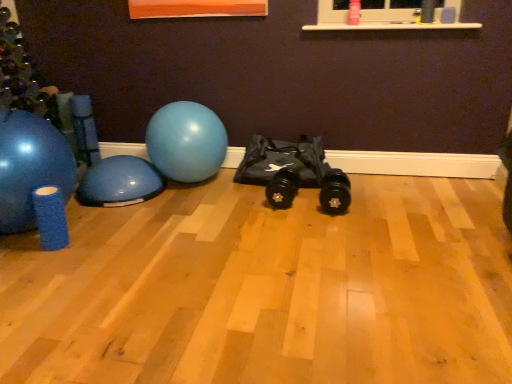
Question: From a real-world perspective, is blue rubber ball at left, which ranks as the 2th ball in left-to-right order, above or below matte blue exercise ball at left, which is the third ball in right-to-left order?

Choices:
 (A) below
 (B) above

Answer: (A)

Question: Is blue rubber ball at left, the second ball when ordered from right to left, situated inside matte blue exercise ball at left, arranged as the first ball when viewed from the left, or outside?

Choices:
 (A) outside
 (B) inside

Answer: (A)

Question: Which object is positioned farthest from the matte blue exercise ball at left, which is the third ball in right-to-left order?

Choices:
 (A) glossy rubber ball at center, which is the 3th ball in left-to-right order
 (B) blue rubber ball at left, which ranks as the 2th ball in left-to-right order

Answer: (A)

Question: Estimate the real-world distances between objects in this image. Which object is farther from the blue rubber ball at left, which ranks as the 2th ball in left-to-right order?

Choices:
 (A) glossy rubber ball at center, the first ball when ordered from right to left
 (B) matte blue exercise ball at left, arranged as the first ball when viewed from the left

Answer: (B)